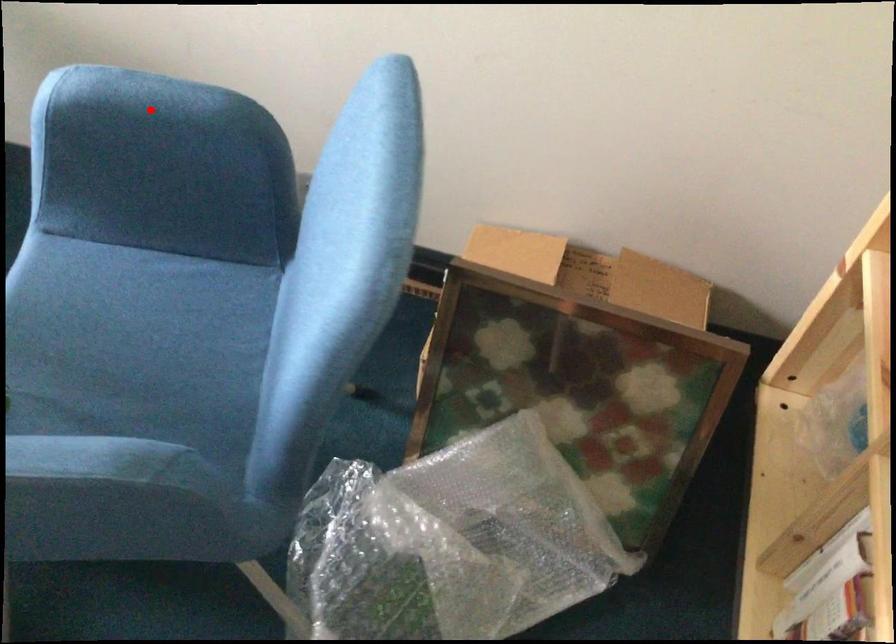
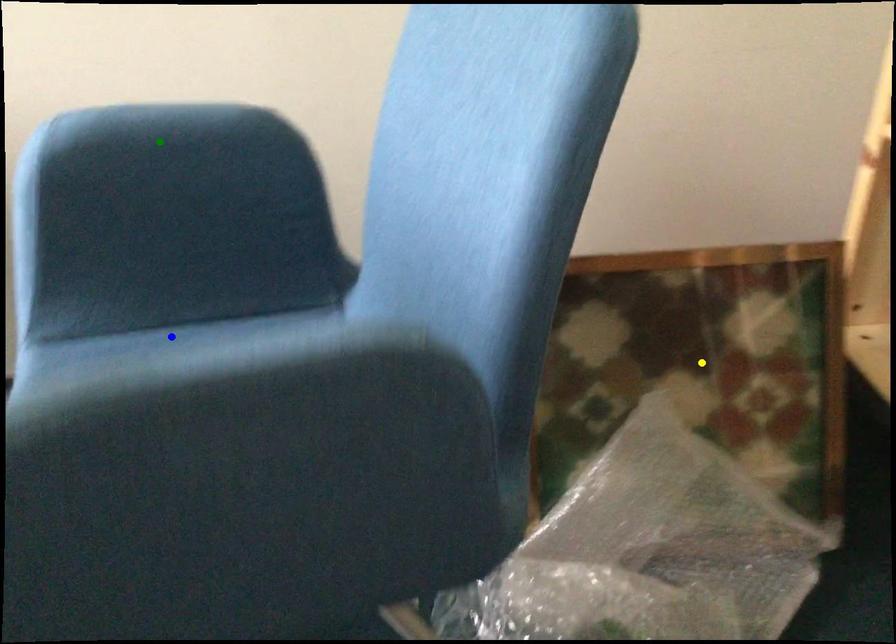
Question: I am providing you with two images of the same scene from different viewpoints. A red point is marked on the first image. You are given multiple points on the second image. Which point in image 2 represents the same 3d spot as the red point in image 1?

Choices:
 (A) blue point
 (B) yellow point
 (C) green point

Answer: (C)